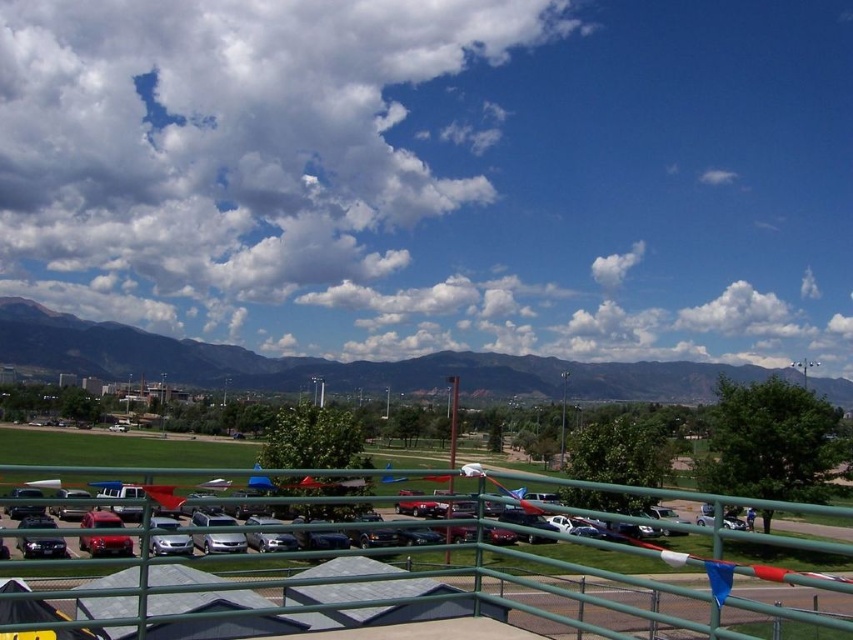
Is the position of green metal railing at center less distant than that of satin silver sedan at center?

Yes, it is.

Does green metal railing at center appear on the right side of satin silver sedan at center?

Correct, you'll find green metal railing at center to the right of satin silver sedan at center.

Is point (146, 598) farther from camera compared to point (207, 518)?

No, (146, 598) is closer to viewer.

At what (x,y) coordinates should I click in order to perform the action: click on green metal railing at center. Please return your answer as a coordinate pair (x, y). This screenshot has height=640, width=853. Looking at the image, I should click on (340, 596).

Between white fluffy cloud at upper center and green metal railing at center, which one appears on the right side from the viewer's perspective?

Positioned to the right is green metal railing at center.

Which of these two, white fluffy cloud at upper center or green metal railing at center, stands taller?

white fluffy cloud at upper center is taller.

Which is in front, point (68, 246) or point (193, 593)?

Point (193, 593) is in front.

The height and width of the screenshot is (640, 853). What are the coordinates of `white fluffy cloud at upper center` in the screenshot? It's located at (247, 164).

Between green grassy field at lower left and satin silver sedan at center, which one has less height?

satin silver sedan at center

Who is more forward, (337, 362) or (201, 525)?

Point (201, 525)

Where is `green grassy field at lower left`? The width and height of the screenshot is (853, 640). green grassy field at lower left is located at coordinates (338, 364).

This screenshot has width=853, height=640. Find the location of `green grassy field at lower left`. green grassy field at lower left is located at coordinates (338, 364).